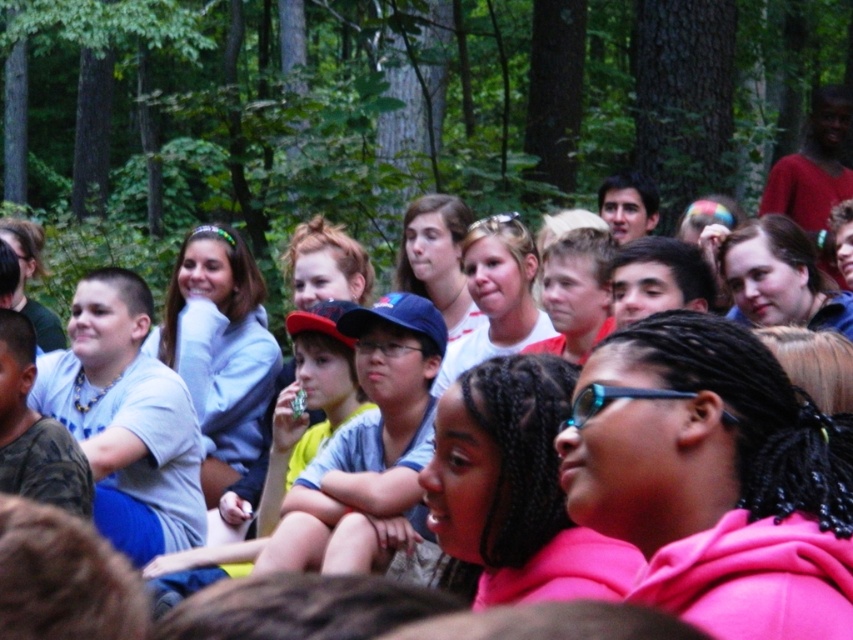
You are a photographer trying to capture a clear photo of the blue plastic goggles at center. You notice the blue fabric cap at center is blocking your view. Based on their sizes, do you think you can adjust your angle slightly to avoid the cap without moving the subject?

The blue fabric cap at center might be wider than blue plastic goggles at center, so adjusting your angle slightly might not be sufficient to avoid the cap. You may need to move closer or reposition yourself to ensure the goggles are fully visible.

From the picture: You are a photographer standing at the edge of the forest. You want to take a photo of the blue fabric cap at center and the blue plastic goggles at center so that both are in focus. The camera you have can only focus on objects within a 10 feet range. Do you think both objects will be in focus?

The blue fabric cap at center is 13.38 feet from blue plastic goggles at center. Since the distance between them is greater than 10 feet, the camera cannot keep both in focus simultaneously.

You are standing in a forest and see two points marked in the image. Which point is closer to you, point (287,545) or point (582,412)?

Point (287,545) is closer to you because it is further to the viewer than point (582,412).